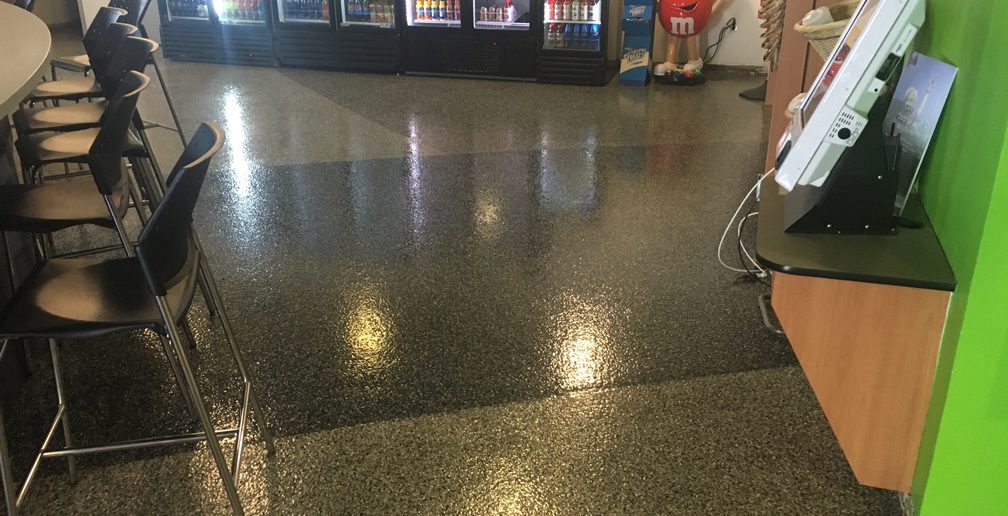
Where is `darker tile on floor`? This screenshot has height=516, width=1008. darker tile on floor is located at coordinates (430, 255).